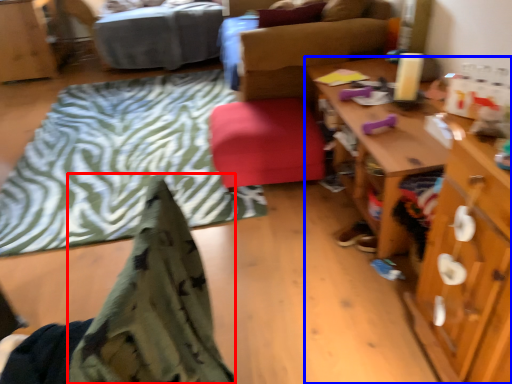
Question: Which object appears closest to the camera in this image, blanket (highlighted by a red box) or desk (highlighted by a blue box)?

Choices:
 (A) blanket
 (B) desk

Answer: (A)